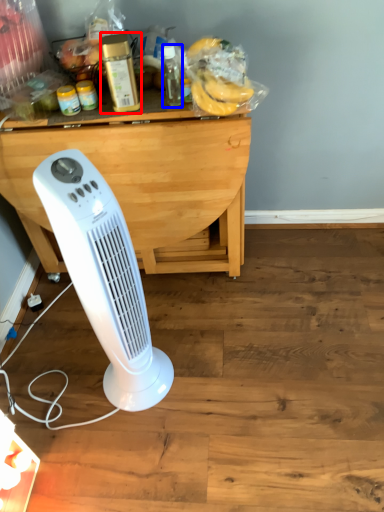
Question: Which point is closer to the camera, bottle (highlighted by a red box) or bottle (highlighted by a blue box)?

Choices:
 (A) bottle
 (B) bottle

Answer: (A)